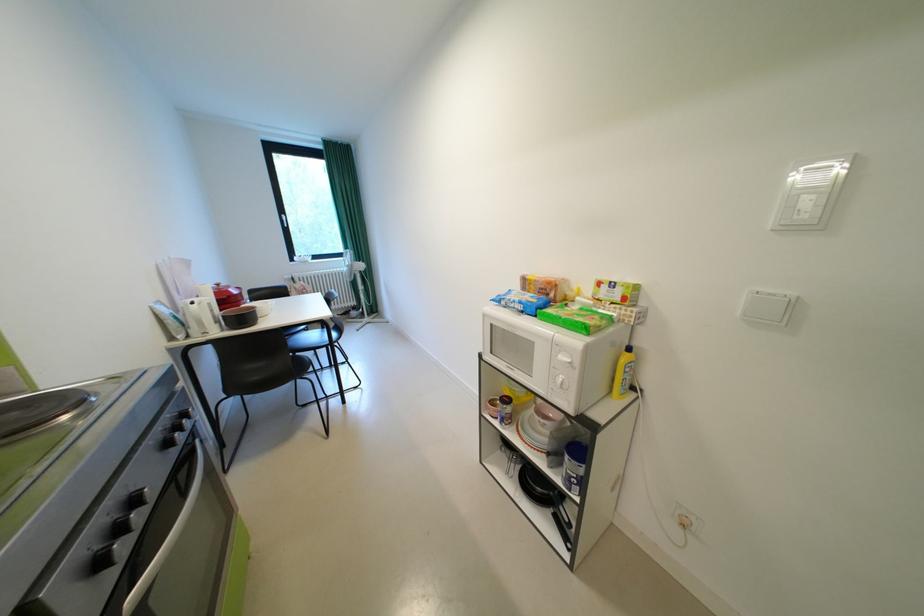
Image resolution: width=924 pixels, height=616 pixels. I want to click on white kettle handle, so click(x=204, y=315).